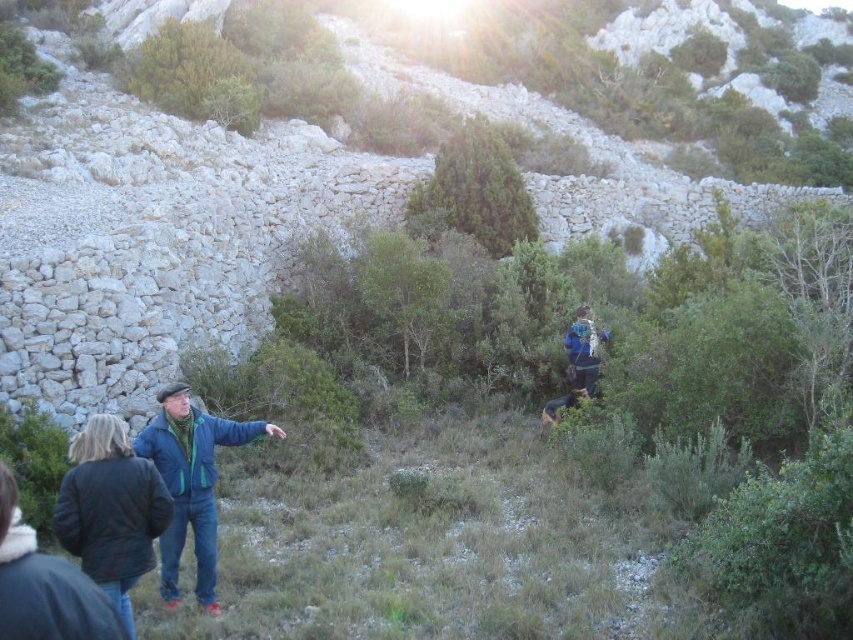
Question: Among these objects, which one is farthest from the camera?

Choices:
 (A) rough stone wall at left
 (B) blue denim jacket at lower left
 (C) dark blue jacket at lower left
 (D) blue fabric backpack at center

Answer: (D)

Question: Which point is farther to the camera?

Choices:
 (A) rough stone wall at left
 (B) dark blue jacket at lower left
 (C) blue denim jacket at lower left
 (D) blue fabric backpack at center

Answer: (D)

Question: Is rough stone wall at left below dark blue jacket at lower left?

Choices:
 (A) yes
 (B) no

Answer: (B)

Question: Can you confirm if dark blue jacket at lower left is smaller than blue denim jacket at lower left?

Choices:
 (A) yes
 (B) no

Answer: (A)

Question: Which point is farther from the camera taking this photo?

Choices:
 (A) (170, 406)
 (B) (171, 141)
 (C) (77, 465)
 (D) (569, 378)

Answer: (B)

Question: Can you confirm if dark blue jacket at lower left is smaller than blue fabric backpack at center?

Choices:
 (A) no
 (B) yes

Answer: (B)